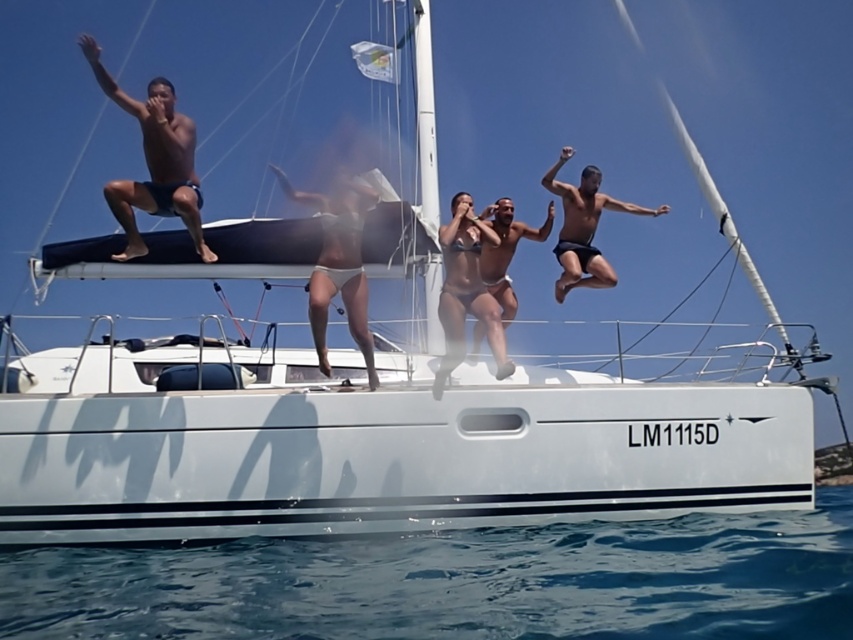
Looking at this image, you are a photographer on the catamaran LM1115D and want to capture a photo of the white matte bikini bottom at center and the black matte shorts at center. Based on their positions, which one should you focus on first if you want to ensure both are in the frame without moving the camera?

The white matte bikini bottom at center is below the black matte shorts at center, so you should focus on the black matte shorts at center first to ensure both are in the frame without moving the camera.

You are standing on the deck of the catamaran and want to jump into the water. There are two points marked on the deck where you can jump from. The first point is at coordinates point (x=173, y=113) and the second is at point (x=560, y=300). Which point is closer to the front of the boat?

Point (x=173, y=113) is in front of point (x=560, y=300), so the first point is closer to the front of the boat.